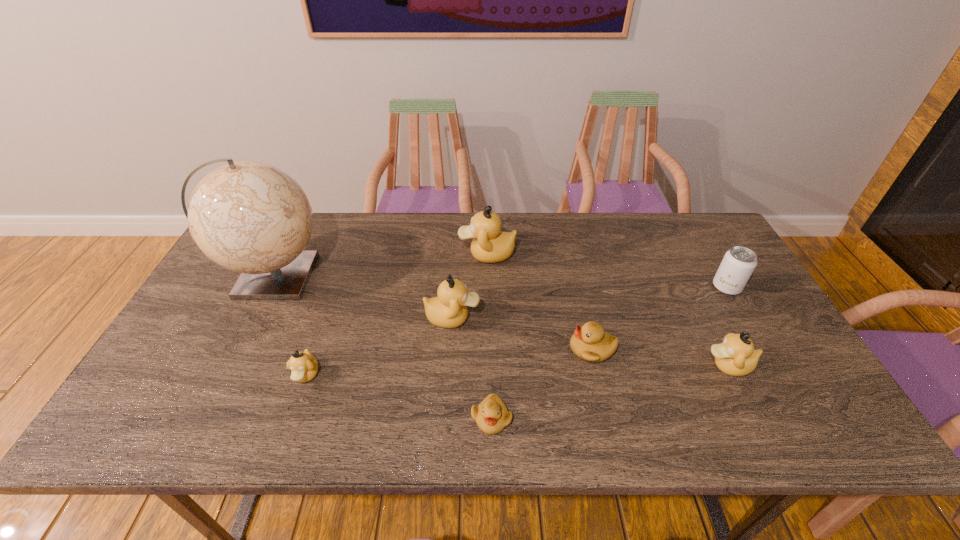
Where is `the third closest duckling relative to the seventh shortest object`? This screenshot has height=540, width=960. the third closest duckling relative to the seventh shortest object is located at coordinates (491, 415).

Locate which tan duckling ranks second in proximity to the rightmost object. Please provide its 2D coordinates. Your answer should be formatted as a tuple, i.e. [(x, y)], where the tuple contains the x and y coordinates of a point satisfying the conditions above.

[(490, 245)]

Point out which tan duckling is positioned as the nearest to the farthest duckling. Please provide its 2D coordinates. Your answer should be formatted as a tuple, i.e. [(x, y)], where the tuple contains the x and y coordinates of a point satisfying the conditions above.

[(449, 310)]

Identify the location of vacant space that satisfies the following two spatial constraints: 1. on the front-facing side of the right yellow duckling; 2. on the front-facing side of the left yellow duckling. (608, 418).

Where is `free space that satisfies the following two spatial constraints: 1. on the face of the farthest tan duckling; 2. on the face of the leftmost tan duckling`? free space that satisfies the following two spatial constraints: 1. on the face of the farthest tan duckling; 2. on the face of the leftmost tan duckling is located at coordinates (489, 375).

This screenshot has height=540, width=960. I want to click on vacant area that satisfies the following two spatial constraints: 1. on the front side of the rightmost object; 2. on the face of the second smallest tan duckling, so [x=773, y=366].